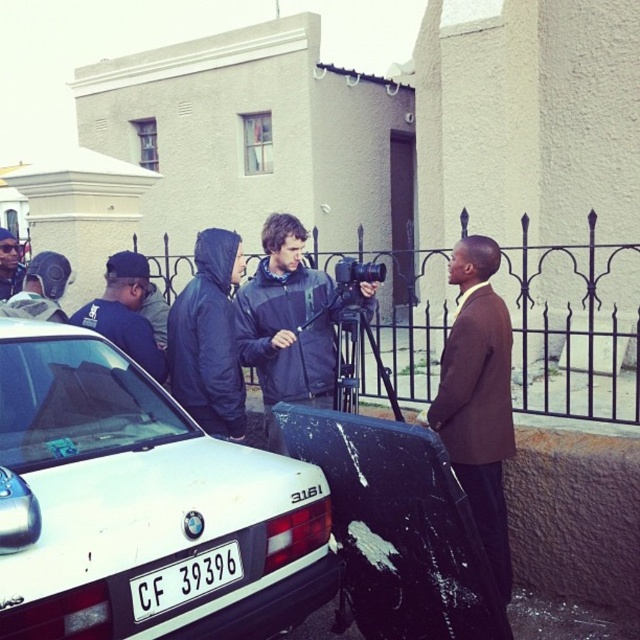
You are a photographer standing at the filming location. You need to capture a photo of both the white matte car at lower left and the dark blue hoodie at left in the same frame. The camera you are using has a maximum focal length that allows capturing objects up to 5 feet apart in the same frame. Can you include both objects in a single photo without moving the camera?

The distance between the white matte car at lower left and the dark blue hoodie at left is 4.15 feet, which is within the camera maximum focal length of 5 feet. Therefore, you can include both objects in a single photo without moving the camera.

You are a photographer positioned at the center of the scene. You need to take a photo that includes both the white matte car at lower left and the dark blue hoodie at left. Which object should you adjust your camera angle upwards to include in the frame?

Since the white matte car at lower left is located below the dark blue hoodie at left, you should adjust your camera angle upwards to include the dark blue hoodie at left in the frame.

You are a photographer positioned behind the camera. You need to focus on the person wearing the brown matte suit at right and the dark blue jacket at center. Which one is closer to you?

The brown matte suit at right is closer to the viewer than the dark blue jacket at center, so the photographer should focus on the brown matte suit at right first as it is nearer.